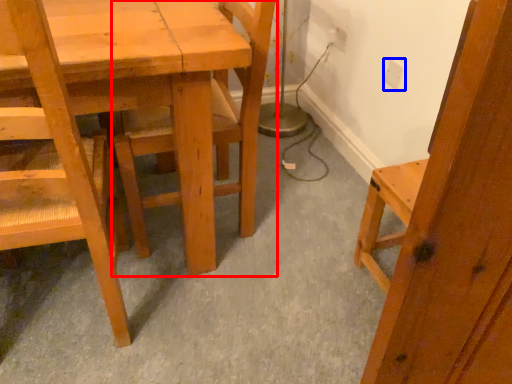
Question: Among these objects, which one is nearest to the camera, chair (highlighted by a red box) or electric outlet (highlighted by a blue box)?

Choices:
 (A) chair
 (B) electric outlet

Answer: (A)